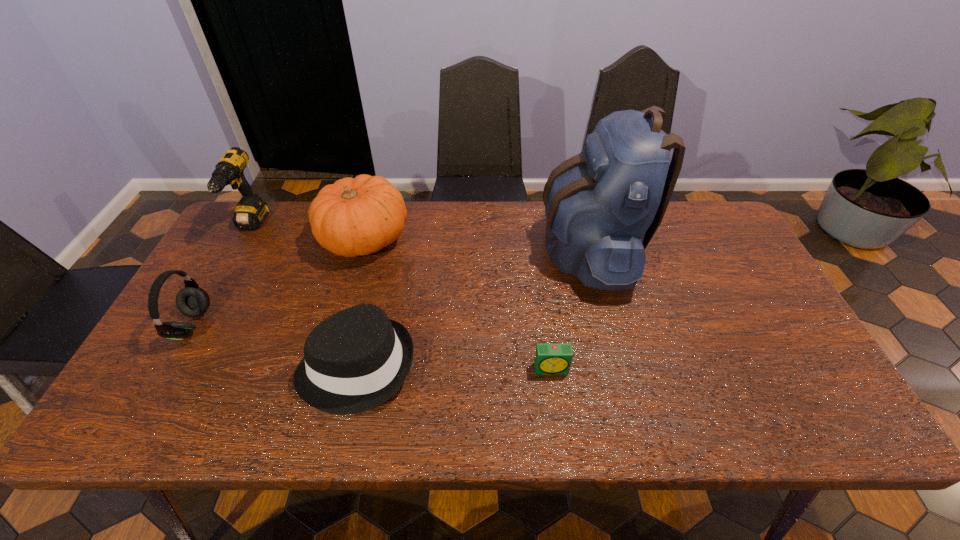
Locate an element on the screen. The image size is (960, 540). free space in the image that satisfies the following two spatial constraints: 1. at the tip of the drill; 2. on the right side of the pumpkin is located at coordinates (244, 239).